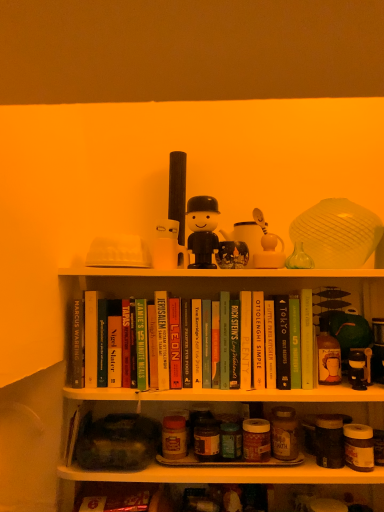
Locate an element on the screen. Image resolution: width=384 pixels, height=512 pixels. free space in front of green matte book at center, which is the 1th paperback book from right to left is located at coordinates (325, 385).